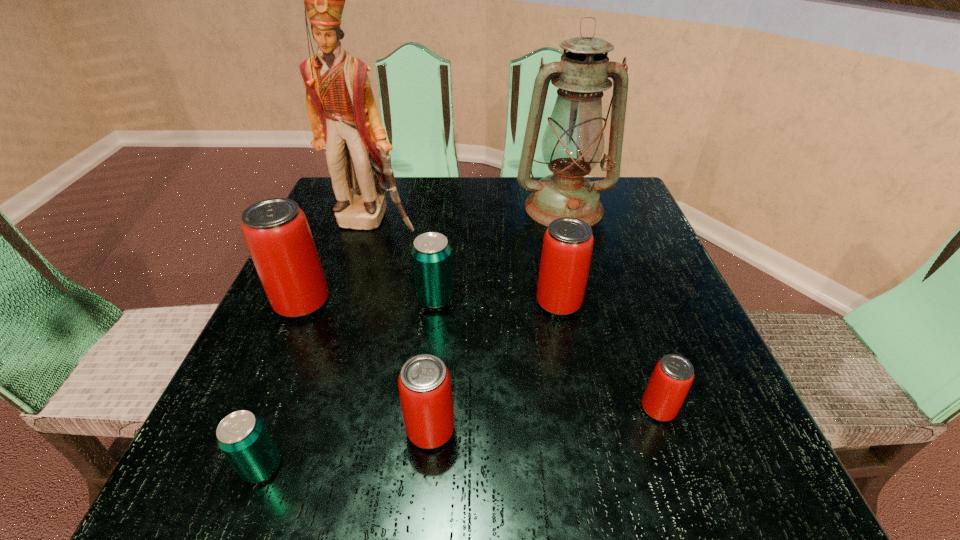
This screenshot has height=540, width=960. In order to click on free space at the near edge of the desktop in this screenshot , I will do `click(561, 448)`.

Image resolution: width=960 pixels, height=540 pixels. Identify the location of free region at the left edge. (314, 313).

You are a GUI agent. You are given a task and a screenshot of the screen. Output one action in this format:
    pyautogui.click(x=<x>, y=<y>)
    Task: Click on the vacant position at the right edge of the desktop
    This screenshot has height=540, width=960.
    Given the screenshot: What is the action you would take?
    pyautogui.click(x=661, y=428)

The image size is (960, 540). In the image, there is a desktop. Identify the location of free space at the far left corner. (327, 210).

At what (x,y) coordinates should I click in order to perform the action: click on free space between the second beer can from right to left and the smallest pink beer can. Please return your answer as a coordinate pair (x, y). Looking at the image, I should click on (609, 356).

The image size is (960, 540). Find the location of `vacant area that lies between the red nutcracker and the second biggest pink beer can`. vacant area that lies between the red nutcracker and the second biggest pink beer can is located at coordinates (467, 262).

Locate an element on the screen. vacant area that lies between the oil lamp and the right teal beer can is located at coordinates (500, 254).

You are a GUI agent. You are given a task and a screenshot of the screen. Output one action in this format:
    pyautogui.click(x=<x>, y=<y>)
    Task: Click on the empty location between the nearer teal beer can and the oil lamp
    
    Given the screenshot: What is the action you would take?
    pyautogui.click(x=413, y=338)

You are a GUI agent. You are given a task and a screenshot of the screen. Output one action in this format:
    pyautogui.click(x=<x>, y=<y>)
    Task: Click on the vacant space that is in between the oil lamp and the nutcracker
    Image resolution: width=960 pixels, height=540 pixels.
    Given the screenshot: What is the action you would take?
    pyautogui.click(x=468, y=214)

In order to click on free space between the second pink beer can from right to left and the red nutcracker in this screenshot , I will do `click(467, 262)`.